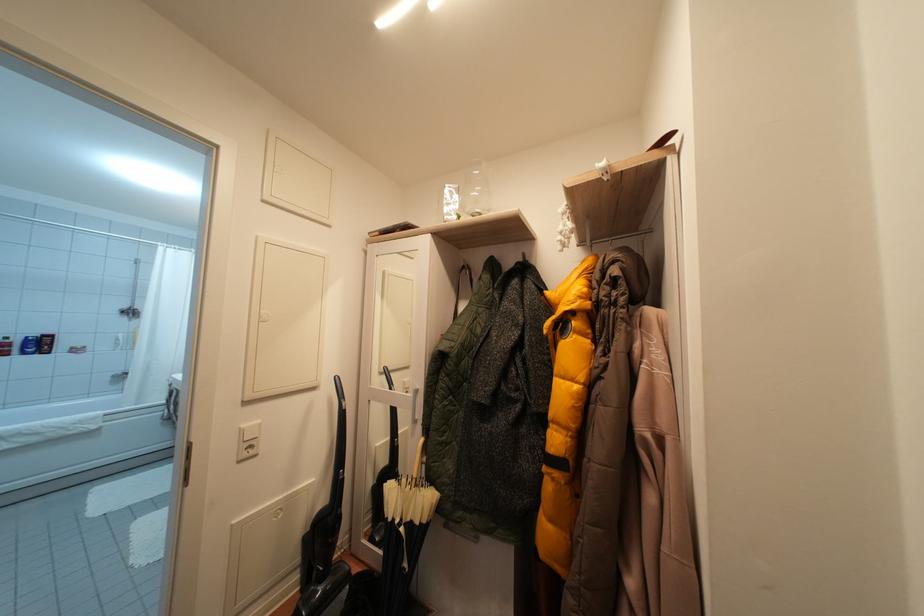
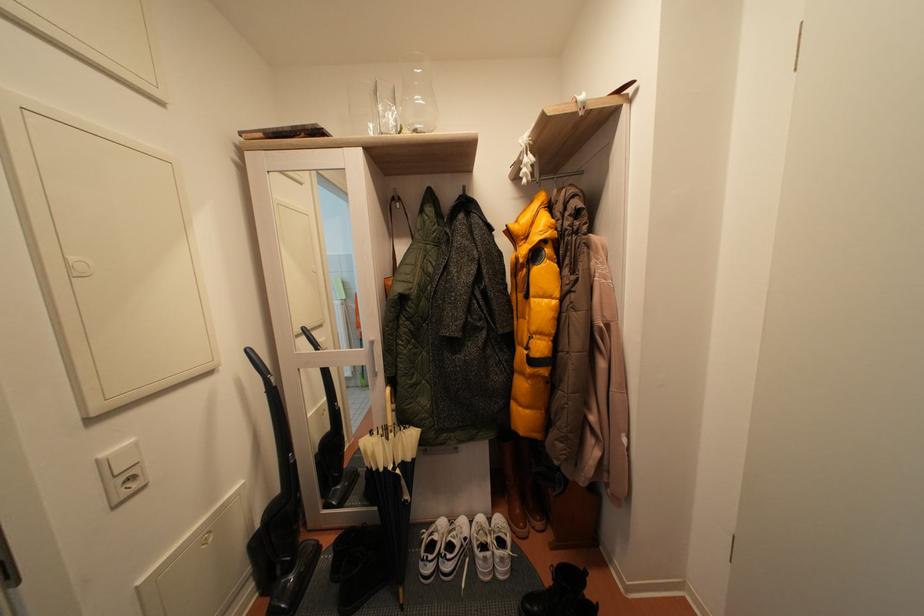
The point at (345, 386) is marked in the first image. Where is the corresponding point in the second image?

(257, 358)